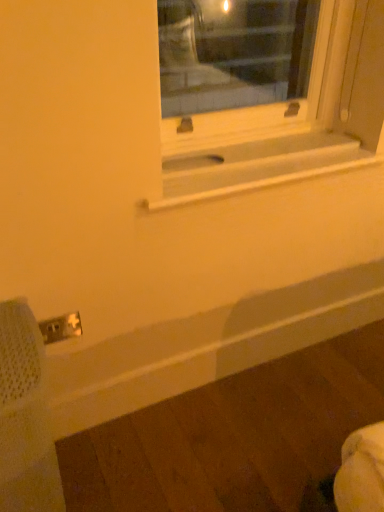
Question: From a real-world perspective, relative to white plastic electric outlet at lower left, is metal mesh swivel chair at lower left vertically above or below?

Choices:
 (A) above
 (B) below

Answer: (B)

Question: Considering their positions, is metal mesh swivel chair at lower left located in front of or behind white plastic electric outlet at lower left?

Choices:
 (A) front
 (B) behind

Answer: (A)

Question: Which of these objects is positioned closest to the white matte window sill at center?

Choices:
 (A) white plastic electric outlet at lower left
 (B) metal mesh swivel chair at lower left

Answer: (A)

Question: Estimate the real-world distances between objects in this image. Which object is farther from the white matte window sill at center?

Choices:
 (A) metal mesh swivel chair at lower left
 (B) white plastic electric outlet at lower left

Answer: (A)